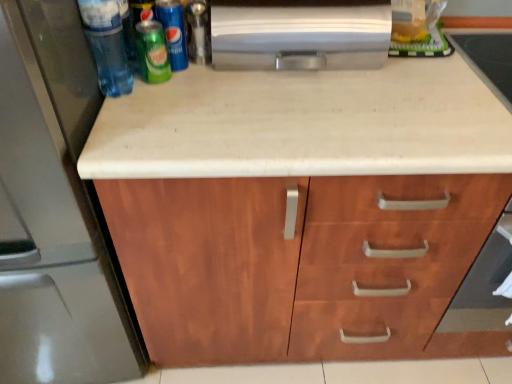
Question: From the image's perspective, does green matte soda can at upper left, acting as the first beer starting from the left, appear higher than green matte pepsi can at upper left, acting as the 1th beer starting from the right?

Choices:
 (A) no
 (B) yes

Answer: (A)

Question: Could you tell me if green matte soda can at upper left, placed as the 2th beer when sorted from right to left, is turned towards green matte pepsi can at upper left, the 2th beer in the left-to-right sequence?

Choices:
 (A) yes
 (B) no

Answer: (B)

Question: Is green matte soda can at upper left, placed as the 2th beer when sorted from right to left, surrounding green matte pepsi can at upper left, acting as the 1th beer starting from the right?

Choices:
 (A) yes
 (B) no

Answer: (B)

Question: Considering the relative positions of green matte soda can at upper left, placed as the 2th beer when sorted from right to left, and green matte pepsi can at upper left, the 2th beer in the left-to-right sequence, in the image provided, is green matte soda can at upper left, placed as the 2th beer when sorted from right to left, to the right of green matte pepsi can at upper left, the 2th beer in the left-to-right sequence, from the viewer's perspective?

Choices:
 (A) no
 (B) yes

Answer: (A)

Question: Is green matte soda can at upper left, placed as the 2th beer when sorted from right to left, positioned with its back to green matte pepsi can at upper left, the 2th beer in the left-to-right sequence?

Choices:
 (A) yes
 (B) no

Answer: (B)

Question: Based on their positions, is satin metallic refrigerator at left located to the left or right of silver metallic paper towel holder at upper center?

Choices:
 (A) right
 (B) left

Answer: (B)

Question: Choose the correct answer: Is satin metallic refrigerator at left inside silver metallic paper towel holder at upper center or outside it?

Choices:
 (A) outside
 (B) inside

Answer: (A)

Question: From their relative heights in the image, would you say satin metallic refrigerator at left is taller or shorter than silver metallic paper towel holder at upper center?

Choices:
 (A) tall
 (B) short

Answer: (A)

Question: Looking at the image, does satin metallic refrigerator at left seem bigger or smaller compared to silver metallic paper towel holder at upper center?

Choices:
 (A) small
 (B) big

Answer: (B)

Question: Is wooden cabinet at center inside the boundaries of green matte soda can at upper left, acting as the first beer starting from the left, or outside?

Choices:
 (A) outside
 (B) inside

Answer: (A)

Question: Considering the positions of point (410, 316) and point (153, 66), is point (410, 316) closer or farther from the camera than point (153, 66)?

Choices:
 (A) farther
 (B) closer

Answer: (A)

Question: From a real-world perspective, is wooden cabinet at center physically located above or below green matte soda can at upper left, placed as the 2th beer when sorted from right to left?

Choices:
 (A) above
 (B) below

Answer: (B)

Question: In terms of size, does wooden cabinet at center appear bigger or smaller than green matte soda can at upper left, placed as the 2th beer when sorted from right to left?

Choices:
 (A) small
 (B) big

Answer: (B)

Question: Is green matte soda can at upper left, placed as the 2th beer when sorted from right to left, taller or shorter than green matte pepsi can at upper left, acting as the 1th beer starting from the right?

Choices:
 (A) short
 (B) tall

Answer: (A)

Question: In terms of width, does green matte soda can at upper left, acting as the first beer starting from the left, look wider or thinner when compared to green matte pepsi can at upper left, acting as the 1th beer starting from the right?

Choices:
 (A) thin
 (B) wide

Answer: (B)